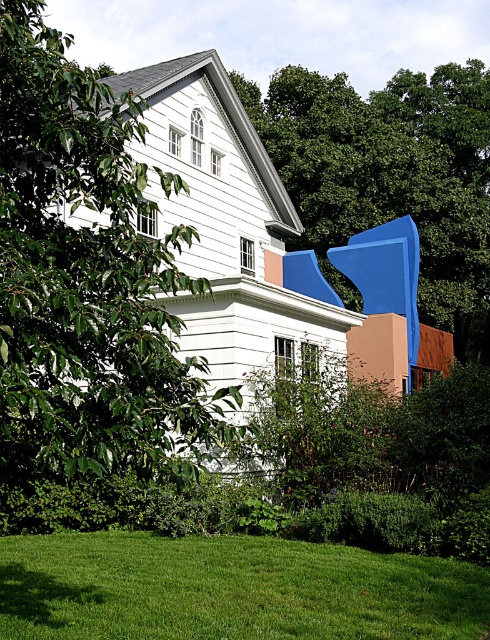
You are standing in front of the house and want to walk towards the green grass at lower center. Will you have to walk around the green leafy tree at left to reach it?

The green leafy tree at left is positioned over green grass at lower center, so you will have to walk around the green leafy tree at left to reach the green grass at lower center.

You are standing in front of the house and want to take a photo that includes both the house and the green leafy tree at left. If you are currently 5 meters away from the house, should you move closer or farther away to include the tree in your photo?

Since the green leafy tree at left is only 4.32 meters away from the camera, you should move closer to the house to include the tree in your photo. Moving closer will widen your field of view, allowing both the house and the tree to fit into the frame.

You are a landscape architect designing a garden for the house. You need to place a new decorative item that requires a wider space. Which location between the green grass at lower center and the blue matte sculpture at upper right would you choose?

The blue matte sculpture at upper right is wider than the green grass at lower center, so you should choose the blue matte sculpture at upper right for placing the new decorative item that requires wider space.